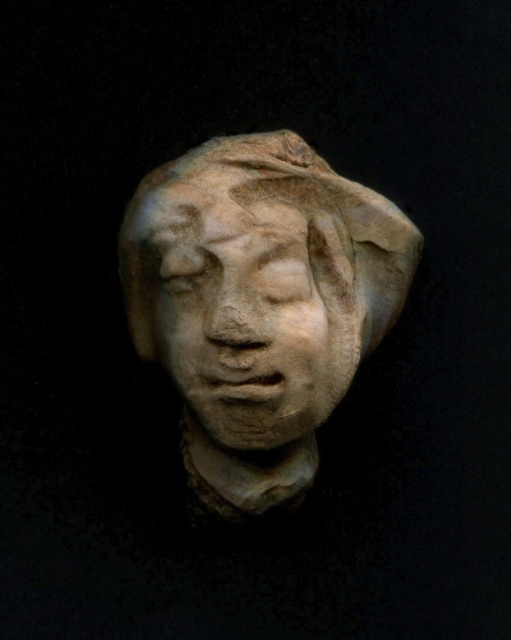
Find the location of a particular element. Image resolution: width=511 pixels, height=640 pixels. matte stone head at center is located at coordinates (259, 305).

Can you confirm if matte stone head at center is thinner than matte stone face at center?

Incorrect, matte stone head at center's width is not less than matte stone face at center's.

Locate an element on the screen. The image size is (511, 640). matte stone head at center is located at coordinates (259, 305).

This screenshot has height=640, width=511. Find the location of `matte stone head at center`. matte stone head at center is located at coordinates (259, 305).